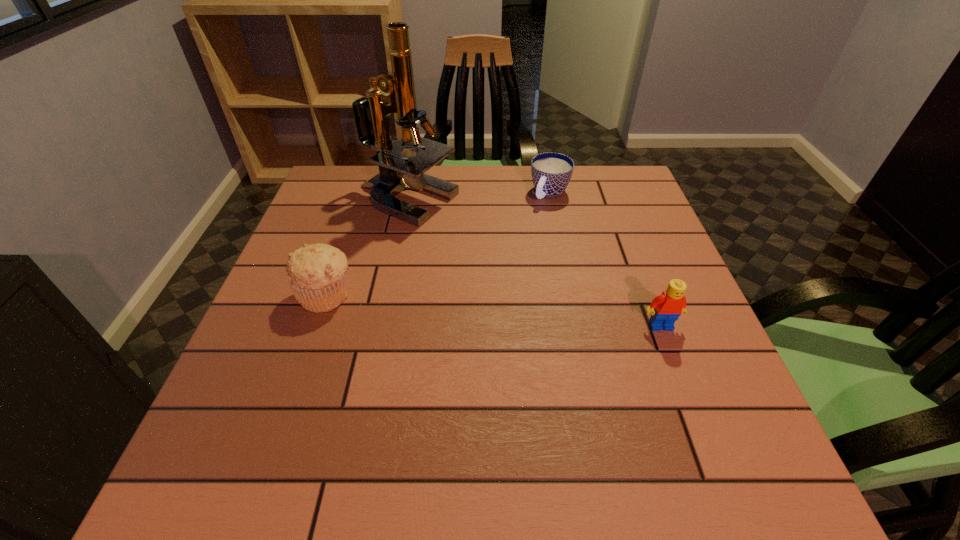
Identify the location of vacant region at the far edge. (509, 198).

Locate an element on the screen. free location at the near edge is located at coordinates (448, 411).

Find the location of a particular element. This screenshot has height=540, width=960. vacant position at the left edge of the desktop is located at coordinates (276, 358).

Locate an element on the screen. This screenshot has width=960, height=540. free spot at the right edge of the desktop is located at coordinates (639, 217).

In order to click on vacant space at the far left corner of the desktop in this screenshot , I will do `click(351, 166)`.

Locate an element on the screen. This screenshot has height=540, width=960. vacant region at the near left corner of the desktop is located at coordinates (229, 405).

Where is `blank space at the far right corner of the desktop`? blank space at the far right corner of the desktop is located at coordinates (595, 171).

Identify the location of free location at the near right corner of the desktop. (745, 416).

Locate an element on the screen. This screenshot has height=540, width=960. empty location between the tallest object and the third object from left to right is located at coordinates (479, 198).

You are a GUI agent. You are given a task and a screenshot of the screen. Output one action in this format:
    pyautogui.click(x=<x>, y=<y>)
    Task: Click on the vacant space that's between the cup and the third farthest object
    Image resolution: width=960 pixels, height=540 pixels.
    Given the screenshot: What is the action you would take?
    pyautogui.click(x=439, y=244)